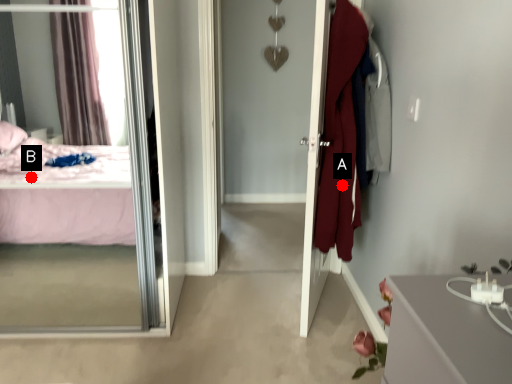
Question: Two points are circled on the image, labeled by A and B beside each circle. Which point is farther to the camera?

Choices:
 (A) A is further
 (B) B is further

Answer: (B)